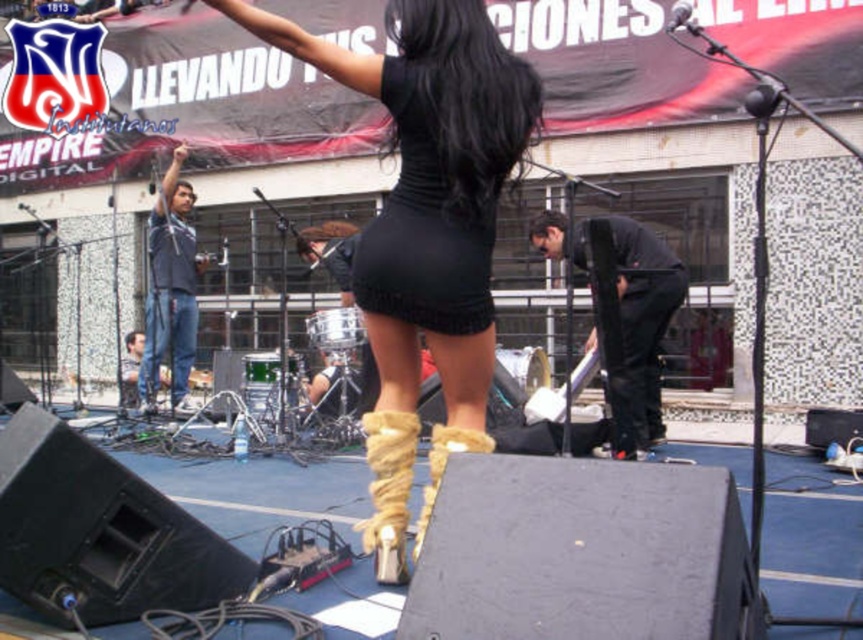
You are a stagehand trying to position a spotlight on the performer wearing the black knit dress at center. According to the coordinates provided, where exactly should you aim the spotlight?

The spotlight should be aimed at the coordinates point (424, 230) where the black knit dress at center is located.

You are a photographer trying to capture the metallic silver microphone at upper center without any obstructions. Since the black matte pants at right are in the way, can you adjust your position to the left to get a clear shot?

The metallic silver microphone at upper center is behind the black matte pants at right, so moving to the left might help you avoid the obstruction caused by the black matte pants at right and capture the microphone clearly.

You are a stagehand setting up the performance area. You notice the tan suede boot at center and the metallic silver microphone at upper center. Which object would require a larger storage container if you need to pack them separately?

The tan suede boot at center requires a larger storage container because it is larger in size than the metallic silver microphone at upper center.